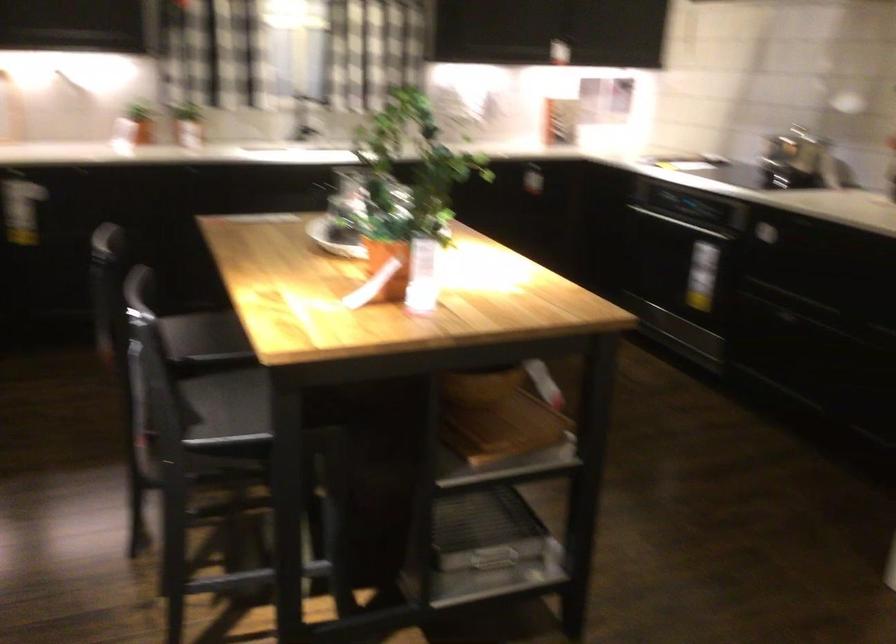
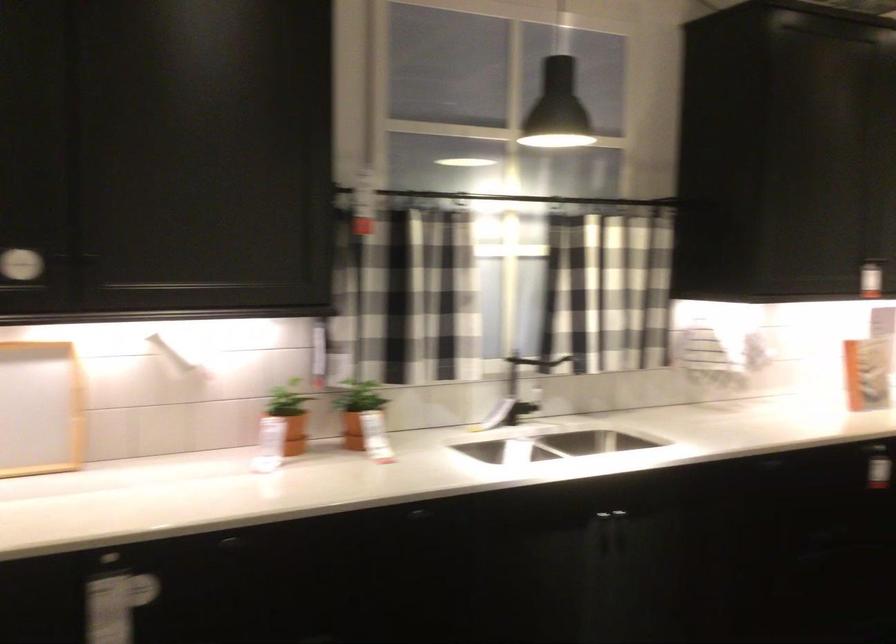
Where in the second image is the point corresponding to the point at 186,114 from the first image?

(357, 410)